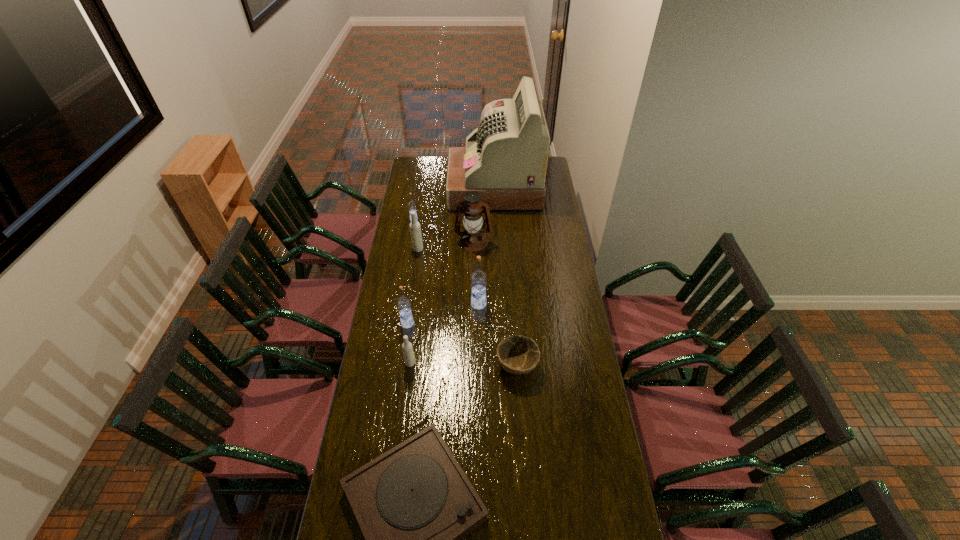
Find the location of a particular element. This screenshot has width=960, height=540. the tallest object is located at coordinates (505, 158).

What are the coordinates of `the farthest object` in the screenshot? It's located at (505, 158).

I want to click on brown lantern, so click(473, 238).

At what (x,y) coordinates should I click in order to perform the action: click on the second nearest blue vodka. Please return your answer as a coordinate pair (x, y). This screenshot has height=540, width=960. Looking at the image, I should click on (478, 278).

Identify the location of the rightmost vodka. coord(478,278).

Where is `the farther white vodka`? The image size is (960, 540). the farther white vodka is located at coordinates (415, 229).

You are a GUI agent. You are given a task and a screenshot of the screen. Output one action in this format:
    pyautogui.click(x=<x>, y=<y>)
    Task: Click on the fourth nearest vodka
    
    Given the screenshot: What is the action you would take?
    pyautogui.click(x=415, y=229)

Locate an element on the screen. Image resolution: width=960 pixels, height=540 pixels. the second nearest vodka is located at coordinates (403, 303).

You are a GUI agent. You are given a task and a screenshot of the screen. Output one action in this format:
    pyautogui.click(x=<x>, y=<y>)
    Task: Click on the second biggest blue vodka
    This screenshot has height=540, width=960.
    Given the screenshot: What is the action you would take?
    pyautogui.click(x=403, y=303)

At what (x,y) coordinates should I click in order to perform the action: click on the nearest vodka. Please return your answer as a coordinate pair (x, y). Image resolution: width=960 pixels, height=540 pixels. Looking at the image, I should click on (407, 348).